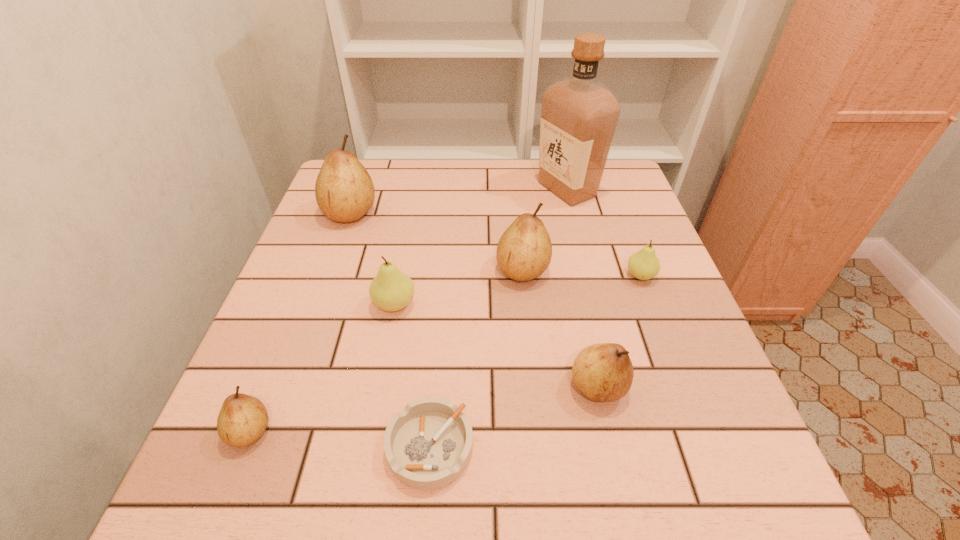
I want to click on liquor, so click(579, 114).

The image size is (960, 540). What are the coordinates of `brown liquor` in the screenshot? It's located at (579, 114).

This screenshot has height=540, width=960. Identify the location of the second tallest object. (344, 191).

You are a GUI agent. You are given a task and a screenshot of the screen. Output one action in this format:
    pyautogui.click(x=<x>, y=<y>)
    Task: Click on the tallest pear
    This screenshot has width=960, height=540.
    Given the screenshot: What is the action you would take?
    pyautogui.click(x=344, y=191)

Identify the location of the sixth shortest object. (524, 251).

The image size is (960, 540). What are the coordinates of `the second biggest brown pear` in the screenshot? It's located at (524, 251).

Locate an element on the screen. the nearer green pear is located at coordinates pyautogui.click(x=391, y=290).

Locate an element on the screen. This screenshot has width=960, height=540. the fourth pear from right to left is located at coordinates (391, 290).

Identify the location of the second pear from right to left. The image size is (960, 540). 603,372.

Locate an element on the screen. This screenshot has height=540, width=960. the rightmost brown pear is located at coordinates (603, 372).